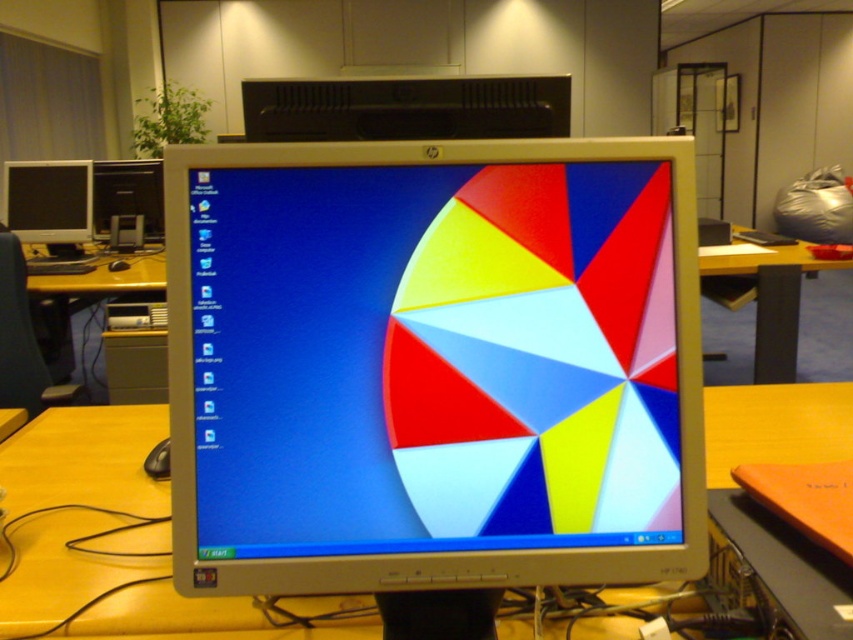
Based on the photo, you are organizing a desk and need to place both the wooden at center and the wooden table at center. Which object should you place first if you want to ensure there is enough space for both?

You should place the wooden table at center first because the wooden at center is smaller and can be placed around it.

You are setting up a new workspace and want to place a matte plastic monitor at center on top of the wooden table at center. Is this possible based on the current arrangement?

The matte plastic monitor at center is located below the wooden table at center, so it is already positioned under the table. To place it on top, you would need to move it from under the table to the surface.